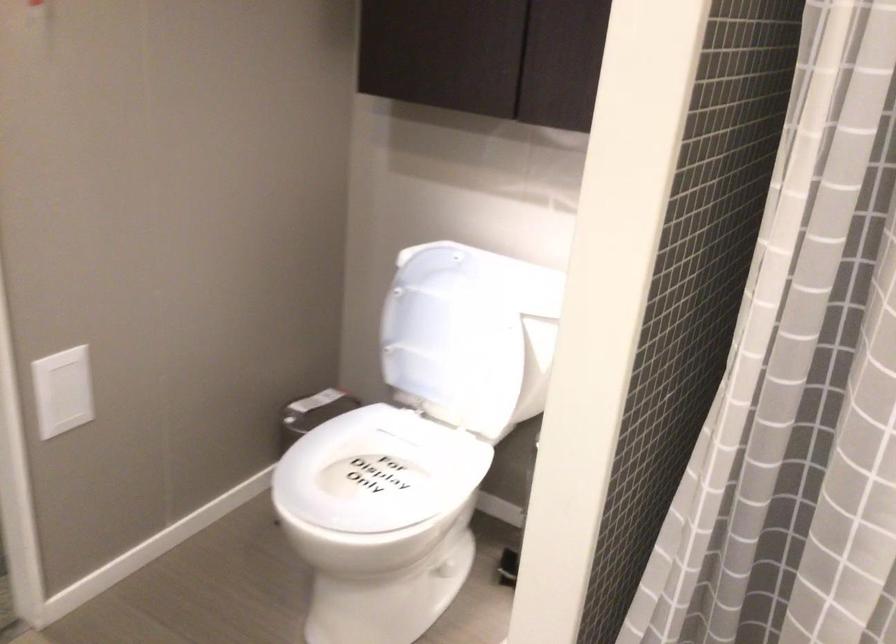
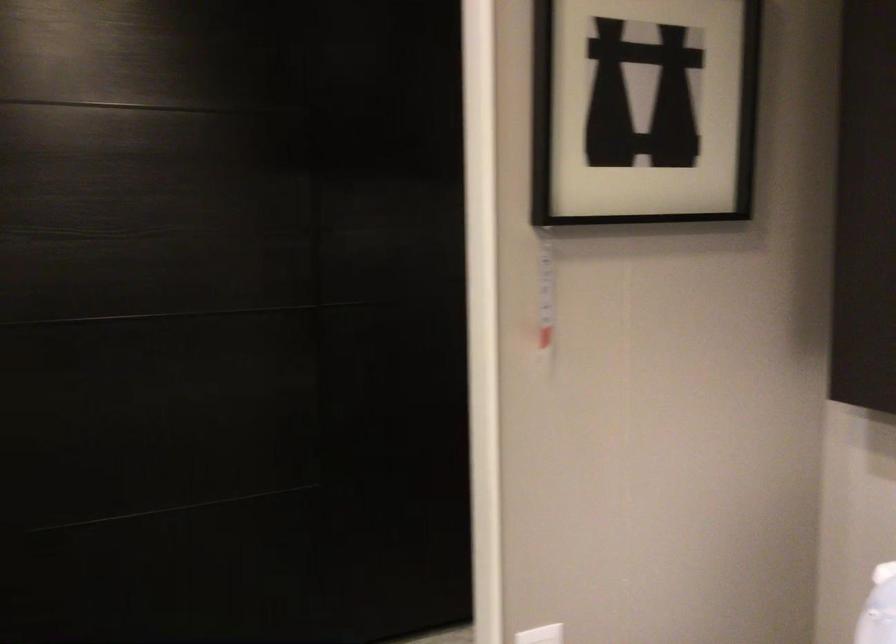
Question: The camera is either moving clockwise (left) or counter-clockwise (right) around the object. The first image is from the beginning of the video and the second image is from the end. Is the camera moving left or right when shooting the video?

Choices:
 (A) Left
 (B) Right

Answer: (B)